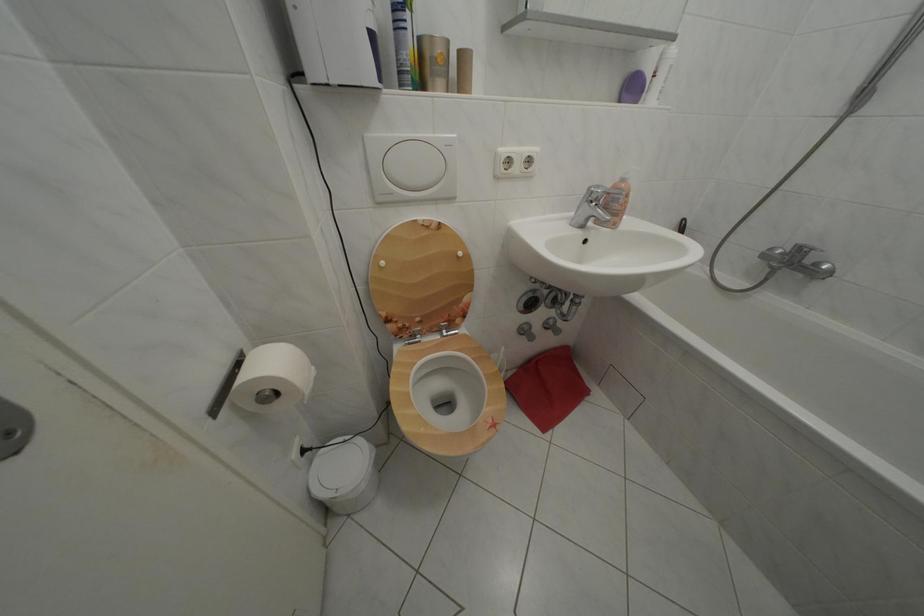
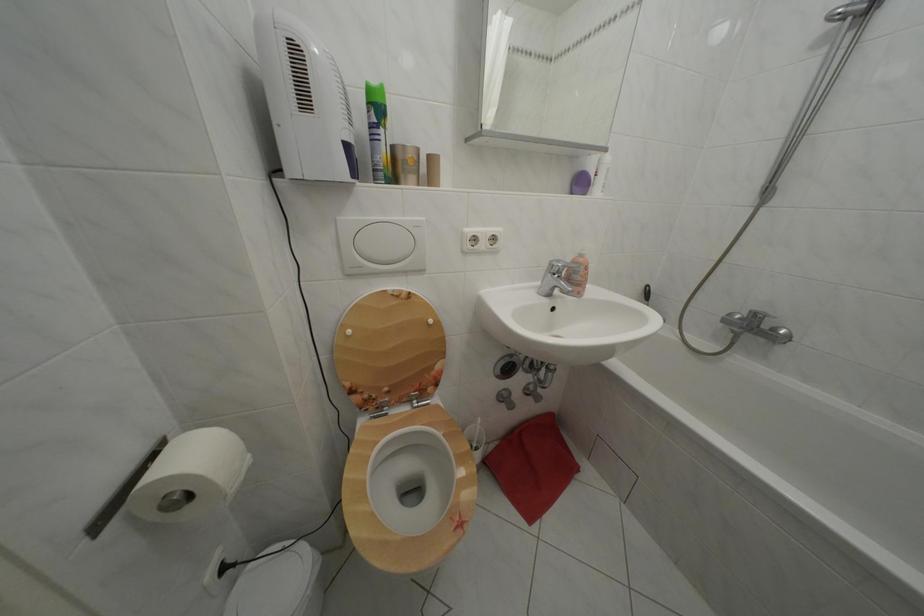
In the second image, find the point that corresponds to point (448, 336) in the first image.

(419, 407)